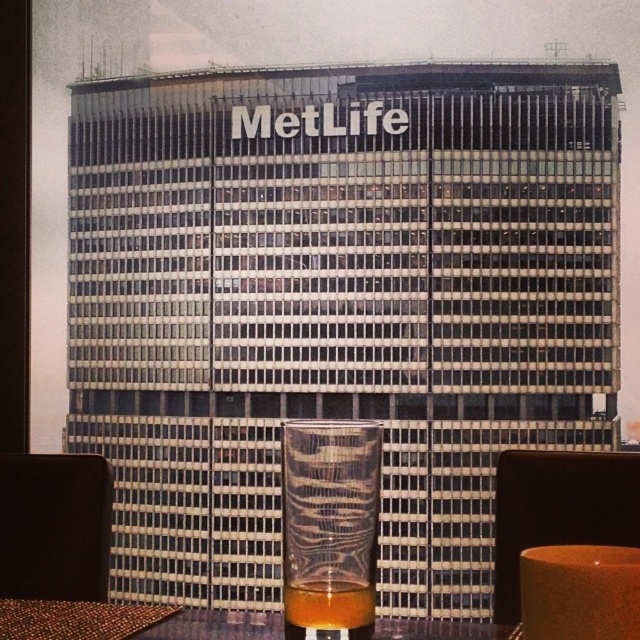
You are standing in a room looking at the translucent glass at center. If you want to move the glass closer to the window to see the MetLife building better, which direction should you move it?

Since the translucent glass at center is located at point (330, 524), moving it towards the window would require moving it in the direction of increasing the x or y coordinate depending on the coordinate system. However, without knowing the exact coordinate orientation, it is safest to assume that moving the glass towards the window would involve moving it towards the right or upward in the image to get closer to the window view.

You are a guest in the room and want to place a small coaster under your drink. Which object should you use to place the coaster, the translucent glass at center or the brown woven table at lower left?

You should place the coaster under the translucent glass at center because it is smaller in size compared to the brown woven table at lower left, making it suitable for holding the coaster and the drink together.